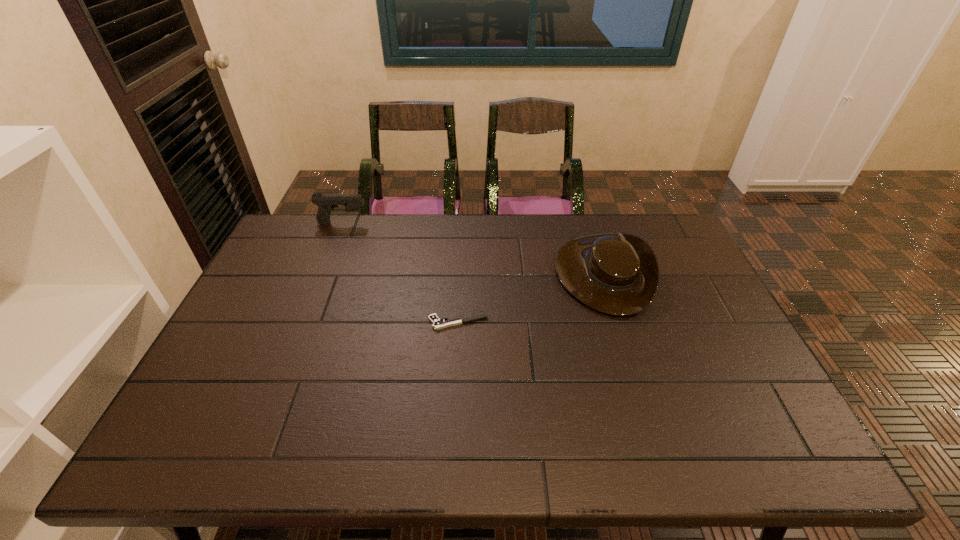
The image size is (960, 540). I want to click on the left pistol, so (326, 203).

Find the location of a particular element. the farther pistol is located at coordinates (326, 203).

Find the location of a particular element. This screenshot has height=540, width=960. cowboy hat is located at coordinates (617, 273).

What are the coordinates of `the rightmost object` in the screenshot? It's located at (617, 273).

I want to click on the nearer pistol, so click(437, 323).

The image size is (960, 540). Find the location of `the shorter pistol`. the shorter pistol is located at coordinates (437, 323).

You are a GUI agent. You are given a task and a screenshot of the screen. Output one action in this format:
    pyautogui.click(x=<x>, y=<y>)
    Task: Click on the free space located 0.240m at the barrel of the left pistol
    Image resolution: width=960 pixels, height=540 pixels.
    Given the screenshot: What is the action you would take?
    pyautogui.click(x=434, y=223)

The height and width of the screenshot is (540, 960). I want to click on vacant area situated on the back of the cowboy hat, so click(x=584, y=215).

Where is `free space located 0.240m on the front-facing side of the shorter pistol`? This screenshot has height=540, width=960. free space located 0.240m on the front-facing side of the shorter pistol is located at coordinates (343, 323).

Locate an element on the screen. vacant space located on the front-facing side of the shorter pistol is located at coordinates (382, 323).